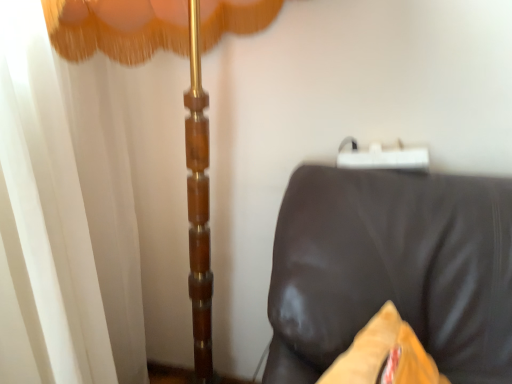
Question: Is brown leather couch at lower right wider than white sheer curtain at left?

Choices:
 (A) no
 (B) yes

Answer: (A)

Question: Does brown leather couch at lower right have a lesser height compared to white sheer curtain at left?

Choices:
 (A) yes
 (B) no

Answer: (A)

Question: Is the depth of brown leather couch at lower right less than that of white sheer curtain at left?

Choices:
 (A) yes
 (B) no

Answer: (A)

Question: Is brown leather couch at lower right bigger than white sheer curtain at left?

Choices:
 (A) yes
 (B) no

Answer: (B)

Question: Does brown leather couch at lower right have a lesser width compared to white sheer curtain at left?

Choices:
 (A) no
 (B) yes

Answer: (B)

Question: Is white sheer curtain at left a part of brown leather couch at lower right?

Choices:
 (A) no
 (B) yes

Answer: (A)

Question: Can you confirm if white sheer curtain at left is positioned to the right of brown leather couch at lower right?

Choices:
 (A) yes
 (B) no

Answer: (B)

Question: Does white sheer curtain at left have a smaller size compared to brown leather couch at lower right?

Choices:
 (A) no
 (B) yes

Answer: (A)

Question: From a real-world perspective, does white sheer curtain at left sit lower than brown leather couch at lower right?

Choices:
 (A) yes
 (B) no

Answer: (B)

Question: Is white sheer curtain at left taller than brown leather couch at lower right?

Choices:
 (A) no
 (B) yes

Answer: (B)

Question: Does white sheer curtain at left appear on the left side of brown leather couch at lower right?

Choices:
 (A) no
 (B) yes

Answer: (B)

Question: From the image's perspective, is white sheer curtain at left under brown leather couch at lower right?

Choices:
 (A) no
 (B) yes

Answer: (A)

Question: In terms of height, does white sheer curtain at left look taller or shorter compared to brown leather couch at lower right?

Choices:
 (A) tall
 (B) short

Answer: (A)